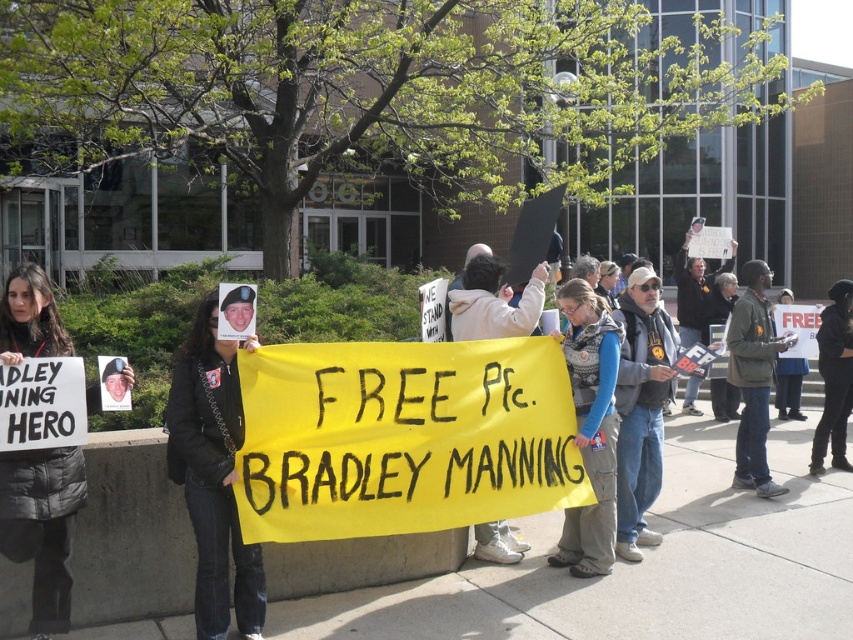
Question: Is denim jacket at center thinner than black fabric jacket at center?

Choices:
 (A) yes
 (B) no

Answer: (A)

Question: Which point is closer to the camera taking this photo?

Choices:
 (A) (839, 442)
 (B) (606, 312)
 (C) (44, 556)
 (D) (216, 620)

Answer: (C)

Question: Which object is farther from the camera taking this photo?

Choices:
 (A) black leather jacket at center
 (B) black fabric jacket at center
 (C) black puffer jacket at upper left
 (D) denim jacket at center

Answer: (B)

Question: Does black puffer jacket at upper left appear over black fabric jacket at center?

Choices:
 (A) yes
 (B) no

Answer: (A)

Question: Is denim jacket at center below black fabric jacket at center?

Choices:
 (A) yes
 (B) no

Answer: (A)

Question: Estimate the real-world distances between objects in this image. Which object is closer to the black puffer jacket at upper left?

Choices:
 (A) black leather jacket at center
 (B) black fabric jacket at center

Answer: (A)